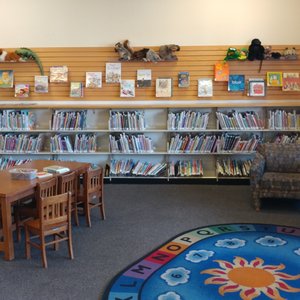
Where is `red rug square`? This screenshot has height=300, width=300. red rug square is located at coordinates (170, 257).